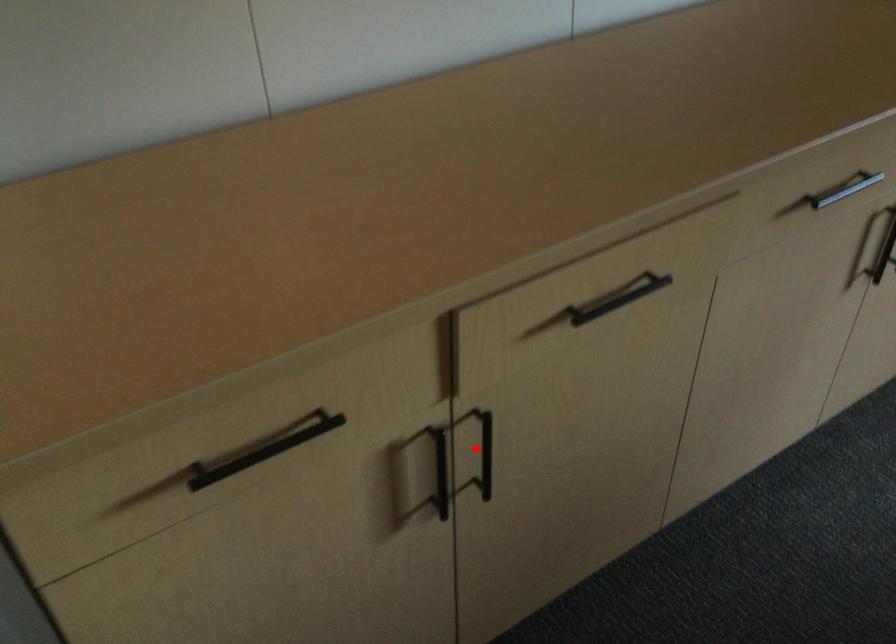
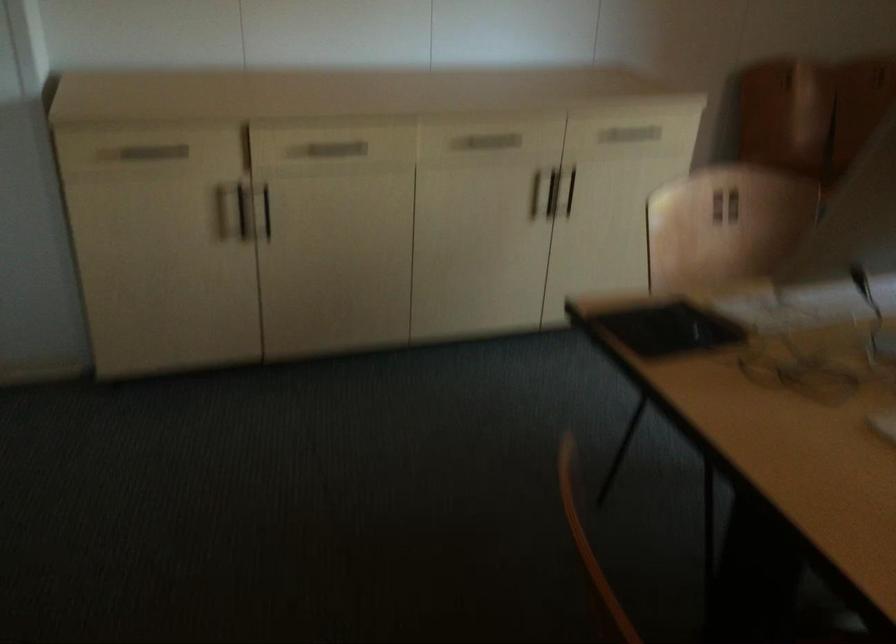
Question: I am providing you with two images of the same scene from different viewpoints. A red point is shown in image1. For the corresponding object point in image2, is it positioned nearer or farther from the camera?

Choices:
 (A) Nearer
 (B) Farther

Answer: (B)